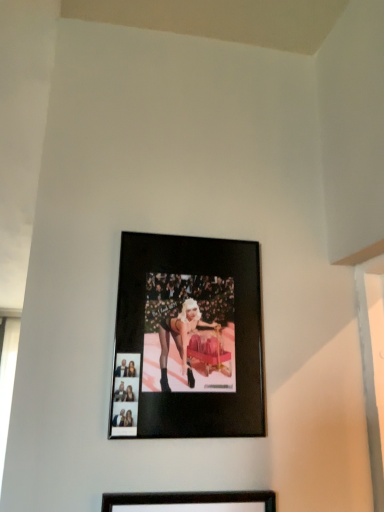
Question: Considering the relative sizes of black matte picture frame at center, the first picture frame positioned from the top, and black matte picture frame at center, the 1th picture frame ordered from the bottom, in the image provided, is black matte picture frame at center, the first picture frame positioned from the top, shorter than black matte picture frame at center, the 1th picture frame ordered from the bottom,?

Choices:
 (A) yes
 (B) no

Answer: (A)

Question: Can we say black matte picture frame at center, marked as the first picture frame in a back-to-front arrangement, lies outside black matte picture frame at center, placed as the 2th picture frame when sorted from back to front?

Choices:
 (A) yes
 (B) no

Answer: (A)

Question: Considering the relative sizes of black matte picture frame at center, marked as the first picture frame in a back-to-front arrangement, and black matte picture frame at center, placed as the 2th picture frame when sorted from back to front, in the image provided, is black matte picture frame at center, marked as the first picture frame in a back-to-front arrangement, taller than black matte picture frame at center, placed as the 2th picture frame when sorted from back to front,?

Choices:
 (A) no
 (B) yes

Answer: (A)

Question: From the image's perspective, would you say black matte picture frame at center, the first picture frame positioned from the top, is shown under black matte picture frame at center, the 1th picture frame ordered from the bottom?

Choices:
 (A) no
 (B) yes

Answer: (A)

Question: From a real-world perspective, is black matte picture frame at center, which ranks as the 2th picture frame in bottom-to-top order, located beneath black matte picture frame at center, the 1th picture frame ordered from the bottom?

Choices:
 (A) yes
 (B) no

Answer: (B)

Question: Is black matte picture frame at center, the 1th picture frame ordered from the bottom, at the back of black matte picture frame at center, marked as the first picture frame in a back-to-front arrangement?

Choices:
 (A) yes
 (B) no

Answer: (B)

Question: From the image's perspective, would you say black matte picture frame at center, which ranks as the 1th picture frame in front-to-back order, is shown under black matte picture frame at center, the second picture frame when ordered from front to back?

Choices:
 (A) yes
 (B) no

Answer: (A)

Question: Does black matte picture frame at center, placed as the 2th picture frame when sorted from back to front, have a larger size compared to black matte picture frame at center, which ranks as the 2th picture frame in bottom-to-top order?

Choices:
 (A) no
 (B) yes

Answer: (A)

Question: Is black matte picture frame at center, the first picture frame positioned from the top, inside black matte picture frame at center, placed as the 2th picture frame when sorted from back to front?

Choices:
 (A) yes
 (B) no

Answer: (B)

Question: From a real-world perspective, is black matte picture frame at center, the 1th picture frame ordered from the bottom, under black matte picture frame at center, marked as the first picture frame in a back-to-front arrangement?

Choices:
 (A) yes
 (B) no

Answer: (A)

Question: Considering the relative sizes of black matte picture frame at center, which ranks as the 1th picture frame in front-to-back order, and black matte picture frame at center, marked as the first picture frame in a back-to-front arrangement, in the image provided, is black matte picture frame at center, which ranks as the 1th picture frame in front-to-back order, thinner than black matte picture frame at center, marked as the first picture frame in a back-to-front arrangement,?

Choices:
 (A) yes
 (B) no

Answer: (A)

Question: Is black matte picture frame at center, the 1th picture frame ordered from the bottom, shorter than black matte picture frame at center, marked as the first picture frame in a back-to-front arrangement?

Choices:
 (A) yes
 (B) no

Answer: (B)

Question: Is black matte picture frame at center, which is the second picture frame from top to bottom, inside the boundaries of black matte picture frame at center, the second picture frame when ordered from front to back, or outside?

Choices:
 (A) outside
 (B) inside

Answer: (A)